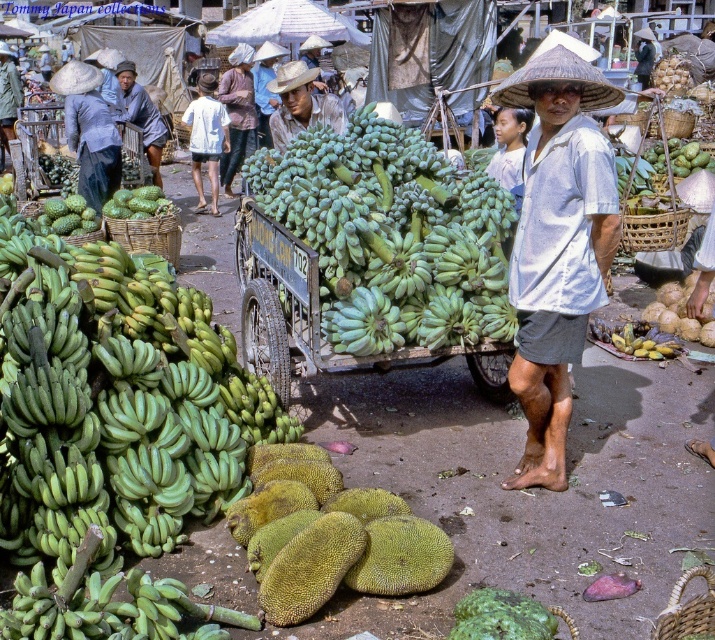
Is green rubber cart at center bigger than white cotton shirt at center?

Correct, green rubber cart at center is larger in size than white cotton shirt at center.

Does green rubber cart at center have a greater height compared to white cotton shirt at center?

No, green rubber cart at center is not taller than white cotton shirt at center.

From the picture: Who is more forward, (413, 353) or (182, 124)?

Positioned in front is point (413, 353).

Where is `green rubber cart at center`? green rubber cart at center is located at coordinates (345, 298).

Can you confirm if light blue cotton shirt at center is thinner than matte gray shirt at center?

Indeed, light blue cotton shirt at center has a lesser width compared to matte gray shirt at center.

Is light blue cotton shirt at center positioned at the back of matte gray shirt at center?

No, it is not.

Is point (591, 285) less distant than point (61, 93)?

Yes, point (591, 285) is closer to viewer.

You are a GUI agent. You are given a task and a screenshot of the screen. Output one action in this format:
    pyautogui.click(x=<x>, y=<y>)
    Task: Click on the light blue cotton shirt at center
    The width and height of the screenshot is (715, 640).
    Given the screenshot: What is the action you would take?
    pyautogui.click(x=557, y=248)

Is light blue cotton shirt at center below green matte jackfruit at center?

Yes, light blue cotton shirt at center is below green matte jackfruit at center.

Which is more to the right, light blue cotton shirt at center or green matte jackfruit at center?

Positioned to the right is light blue cotton shirt at center.

Who is more forward, (552, 88) or (128, 198)?

Point (552, 88) is more forward.

Identify the location of light blue cotton shirt at center. The width and height of the screenshot is (715, 640). click(557, 248).